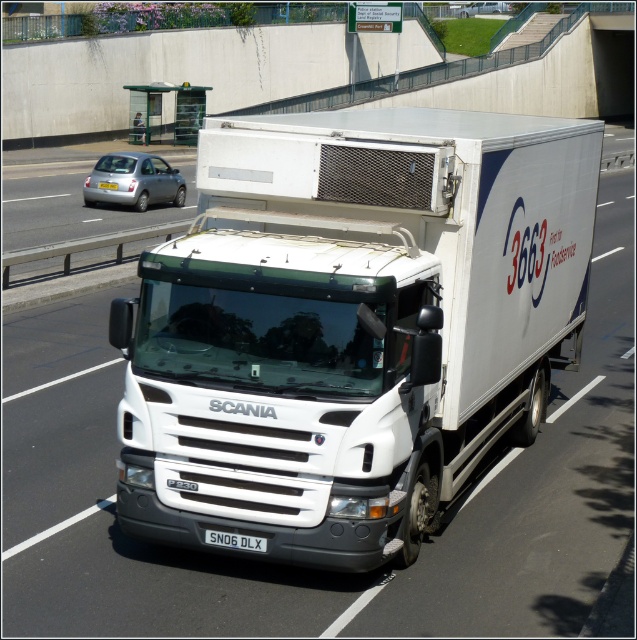
Question: Where is white matte truck at center located in relation to white plastic license plate at center in the image?

Choices:
 (A) right
 (B) left

Answer: (A)

Question: Is white matte truck at center thinner than white plastic license plate at center?

Choices:
 (A) no
 (B) yes

Answer: (A)

Question: Which object is closer to the camera taking this photo?

Choices:
 (A) white matte truck at center
 (B) black plastic license plate at center
 (C) white plastic license plate at center
 (D) silver metallic hatchback at left

Answer: (A)

Question: Which object is closer to the camera taking this photo?

Choices:
 (A) black plastic license plate at center
 (B) white plastic license plate at center
 (C) silver metallic hatchback at left

Answer: (A)

Question: Can you confirm if white matte truck at center is smaller than black plastic license plate at center?

Choices:
 (A) yes
 (B) no

Answer: (B)

Question: Based on their relative distances, which object is nearer to the black plastic license plate at center?

Choices:
 (A) silver metallic hatchback at left
 (B) white matte truck at center

Answer: (B)